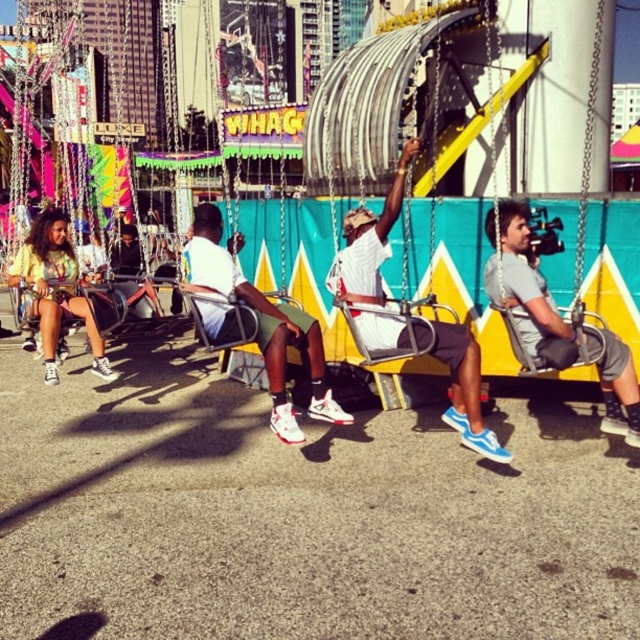
Question: Is gray fabric shorts at center thinner than matte gray swing at center?

Choices:
 (A) no
 (B) yes

Answer: (B)

Question: Can you confirm if white matte shirt at center is thinner than gray fabric shorts at center?

Choices:
 (A) no
 (B) yes

Answer: (A)

Question: Estimate the real-world distances between objects in this image. Which object is closer to the white matte sneakers at center?

Choices:
 (A) white matte shirt at center
 (B) matte gray swing at center
 (C) yellow-green jersey at left
 (D) gray fabric shorts at center

Answer: (A)

Question: Is white matte shirt at center to the left of gray fabric shorts at center from the viewer's perspective?

Choices:
 (A) no
 (B) yes

Answer: (B)

Question: Which point is closer to the camera taking this photo?

Choices:
 (A) (13, 268)
 (B) (600, 42)
 (C) (515, 211)

Answer: (C)

Question: Which is nearer to the matte gray swing at center?

Choices:
 (A) yellow-green jersey at left
 (B) gray fabric shorts at center

Answer: (B)